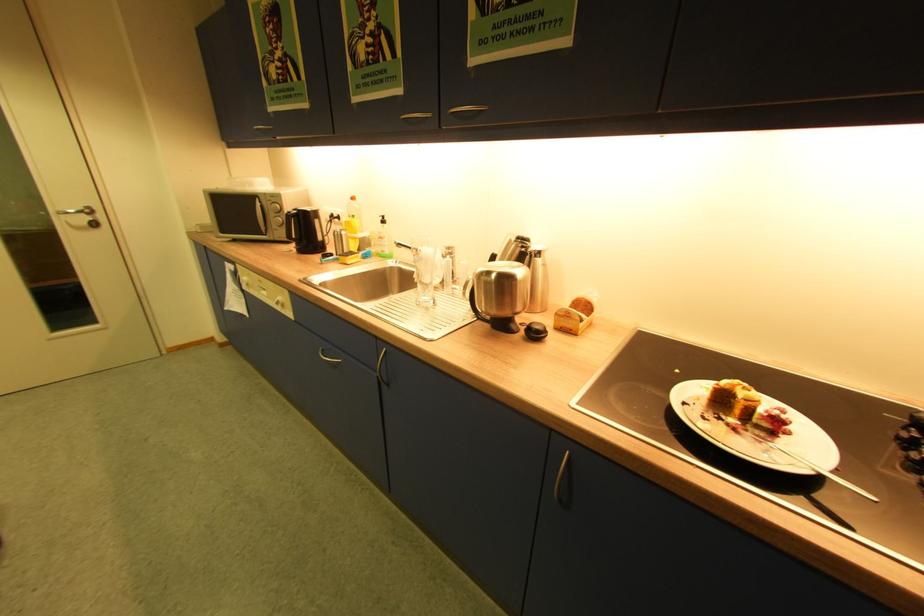
Where would you lift the kettle lid handle? Please return your answer as a coordinate pair (x, y).

(532, 259)